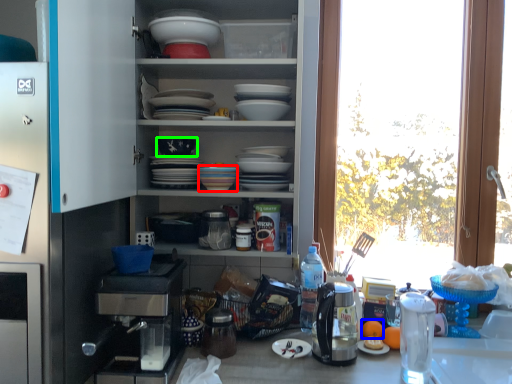
Question: Which is nearer to the tableware (highlighted by a red box)? orange juice (highlighted by a blue box) or bowl (highlighted by a green box).

Choices:
 (A) orange juice
 (B) bowl

Answer: (B)